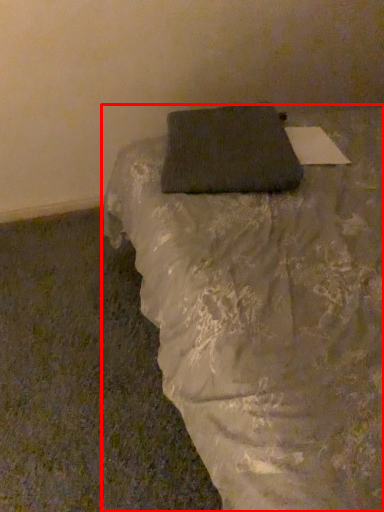
Question: From the image, what is the correct spatial relationship of furniture (annotated by the red box) in relation to pillow?

Choices:
 (A) right
 (B) left

Answer: (A)